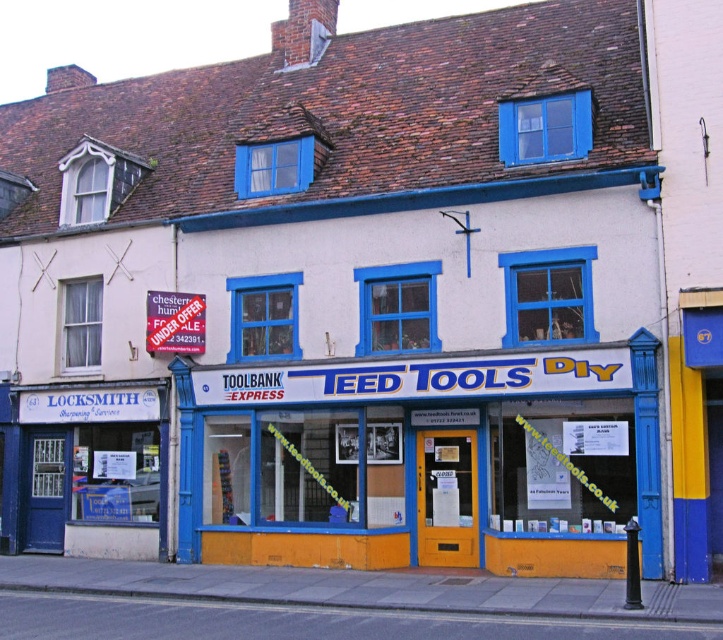
Question: In this image, where is yellow matte door at center located relative to white plastic sign at upper left?

Choices:
 (A) right
 (B) left

Answer: (A)

Question: Observing the image, what is the correct spatial positioning of yellow matte door at center in reference to white plastic sign at upper left?

Choices:
 (A) left
 (B) right

Answer: (B)

Question: Which object is closer to the camera taking this photo?

Choices:
 (A) white plastic sign at upper left
 (B) yellow matte door at center

Answer: (B)

Question: Which object appears closest to the camera in this image?

Choices:
 (A) yellow matte door at center
 (B) white plastic sign at upper left

Answer: (A)

Question: Is yellow matte door at center smaller than white plastic sign at upper left?

Choices:
 (A) no
 (B) yes

Answer: (A)

Question: Which object appears farthest from the camera in this image?

Choices:
 (A) white plastic sign at upper left
 (B) yellow matte door at center

Answer: (A)